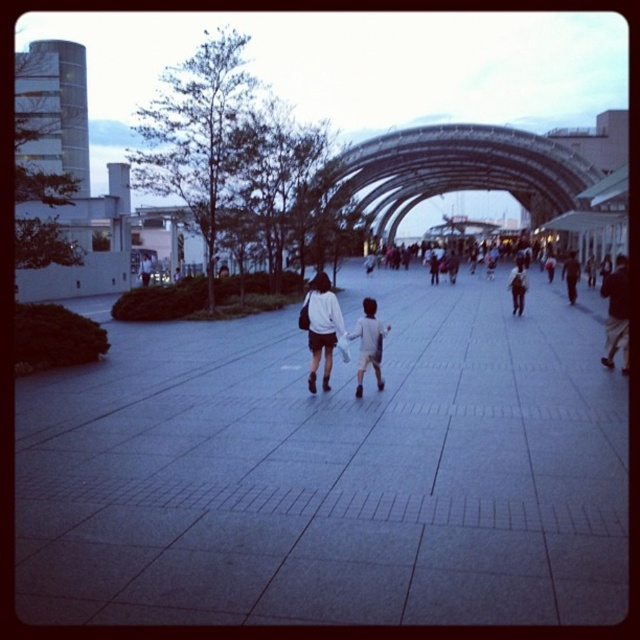
You are a delivery person who needs to place a package between the white matte jacket at center and the dark fabric jacket at center. The package requires a space of 8 meters. Can you fit it between them?

The white matte jacket at center and dark fabric jacket at center are 8.28 meters apart from each other, so yes, the package requiring 8 meters of space can fit between them since the distance is sufficient.

You are a photographer trying to capture a candid shot of the two jackets in the plaza. You want to ensure the white matte jacket at center and the dark fabric jacket at center are both visible in the frame. Based on their positions, which jacket should you focus on first to include both in the shot?

The white matte jacket at center is to the left of the dark fabric jacket at center, so you should focus on the dark fabric jacket at center first to ensure both jackets are within the frame.

You are a fashion designer analyzing the image of a woman and child in a plaza. You notice the white matte jacket at center and the dark blue jeans at center. Which clothing item takes up more visual space in the image?

The dark blue jeans at center occupies more visual space than the white matte jacket at center, as stated in the description.